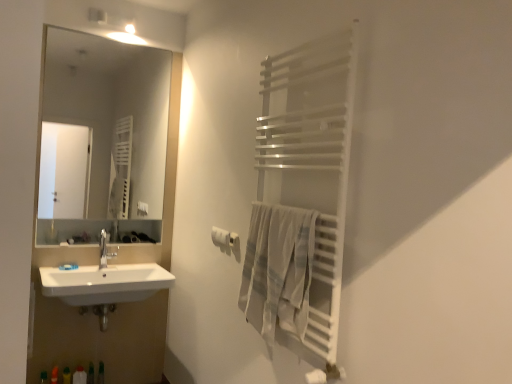
What are the coordinates of `white matte towel bar at upper right` in the screenshot? It's located at (233, 239).

Where is `white plastic bottle at lower left, which appears as the first toiletry when viewed from the left`? This screenshot has height=384, width=512. white plastic bottle at lower left, which appears as the first toiletry when viewed from the left is located at coordinates (79, 376).

How much space does white plastic bottle at lower left, which ranks as the second toiletry in right-to-left order, occupy horizontally?

white plastic bottle at lower left, which ranks as the second toiletry in right-to-left order, is 3.28 inches in width.

What are the coordinates of `white metallic towel rack at right` in the screenshot? It's located at (311, 161).

The width and height of the screenshot is (512, 384). What do you see at coordinates (311, 161) in the screenshot? I see `white metallic towel rack at right` at bounding box center [311, 161].

The image size is (512, 384). What do you see at coordinates (278, 269) in the screenshot? I see `light gray woven towel at right` at bounding box center [278, 269].

What do you see at coordinates (100, 373) in the screenshot? I see `translucent plastic bottle at lower left, which is the 1th toiletry in right-to-left order` at bounding box center [100, 373].

This screenshot has width=512, height=384. What do you see at coordinates (221, 236) in the screenshot?
I see `white matte toilet paper at center` at bounding box center [221, 236].

Where is `clear glass mirror at upper left`? This screenshot has width=512, height=384. clear glass mirror at upper left is located at coordinates tap(102, 140).

Is white matte toilet paper at center facing away from white plastic bottle at lower left, which appears as the first toiletry when viewed from the left?

That's not correct — white matte toilet paper at center is not looking away from white plastic bottle at lower left, which appears as the first toiletry when viewed from the left.

Which point is more forward, (213, 238) or (74, 376)?

The point (213, 238) is closer.

Which object is positioned more to the left, white matte toilet paper at center or white plastic bottle at lower left, which ranks as the second toiletry in right-to-left order?

From the viewer's perspective, white plastic bottle at lower left, which ranks as the second toiletry in right-to-left order, appears more on the left side.

Is light gray woven towel at right looking in the opposite direction of translucent plastic bottle at lower left, which is the 1th toiletry in right-to-left order?

No, translucent plastic bottle at lower left, which is the 1th toiletry in right-to-left order, is not at the back of light gray woven towel at right.

Which of these two, light gray woven towel at right or translucent plastic bottle at lower left, placed as the 2th toiletry when sorted from left to right, stands shorter?

translucent plastic bottle at lower left, placed as the 2th toiletry when sorted from left to right.

Does light gray woven towel at right have a smaller size compared to translucent plastic bottle at lower left, placed as the 2th toiletry when sorted from left to right?

No, light gray woven towel at right is not smaller than translucent plastic bottle at lower left, placed as the 2th toiletry when sorted from left to right.

Image resolution: width=512 pixels, height=384 pixels. What are the coordinates of `bath towel above the translucent plastic bottle at lower left, placed as the 2th toiletry when sorted from left to right (from the image's perspective)` in the screenshot? It's located at (278, 269).

From the picture: Between translucent plastic bottle at lower left, placed as the 2th toiletry when sorted from left to right, and white metallic towel rack at right, which one is positioned in front?

white metallic towel rack at right.

Looking at this image, is translucent plastic bottle at lower left, placed as the 2th toiletry when sorted from left to right, turned away from white metallic towel rack at right?

That's not correct — translucent plastic bottle at lower left, placed as the 2th toiletry when sorted from left to right, is not looking away from white metallic towel rack at right.

From the image's perspective, is translucent plastic bottle at lower left, placed as the 2th toiletry when sorted from left to right, positioned above or below white metallic towel rack at right?

From the image's perspective, translucent plastic bottle at lower left, placed as the 2th toiletry when sorted from left to right, appears below white metallic towel rack at right.

Is satin nickel faucet at sink left completely or partially outside of white matte towel bar at upper right?

That's correct, satin nickel faucet at sink left is outside of white matte towel bar at upper right.

Can you confirm if satin nickel faucet at sink left is wider than white matte towel bar at upper right?

Yes, satin nickel faucet at sink left is wider than white matte towel bar at upper right.

From a real-world perspective, is satin nickel faucet at sink left below white matte towel bar at upper right?

Yes, from a real-world perspective, satin nickel faucet at sink left is beneath white matte towel bar at upper right.

Locate an element on the screen. towel bar that is above the satin nickel faucet at sink left (from the image's perspective) is located at coordinates (233, 239).

Based on the photo, how many degrees apart are the facing directions of satin nickel faucet at sink left and white metallic towel rack at right?

The angular difference between satin nickel faucet at sink left and white metallic towel rack at right is 87.7 degrees.

Does satin nickel faucet at sink left have a greater height compared to white metallic towel rack at right?

Incorrect, the height of satin nickel faucet at sink left is not larger of that of white metallic towel rack at right.

Is satin nickel faucet at sink left positioned with its back to white metallic towel rack at right?

No, satin nickel faucet at sink left is not facing the opposite direction of white metallic towel rack at right.

Considering the relative sizes of satin nickel faucet at sink left and white metallic towel rack at right in the image provided, is satin nickel faucet at sink left smaller than white metallic towel rack at right?

Correct, satin nickel faucet at sink left occupies less space than white metallic towel rack at right.

Which object is positioned more to the left, white matte toilet paper at center or light gray woven towel at right?

white matte toilet paper at center is more to the left.

Is point (223, 235) positioned behind point (263, 301)?

Yes, point (223, 235) is behind point (263, 301).

Which of these two, white matte toilet paper at center or light gray woven towel at right, stands taller?

light gray woven towel at right is taller.

Is there a large distance between white metallic towel rack at right and light gray woven towel at right?

No, white metallic towel rack at right is not far away from light gray woven towel at right.

Identify the location of balustrade on the left of light gray woven towel at right. The width and height of the screenshot is (512, 384). (311, 161).

Considering the points (273, 163) and (256, 225), which point is behind, point (273, 163) or point (256, 225)?

The point (273, 163) is farther.

The width and height of the screenshot is (512, 384). In order to click on the 1st toiletry behind when counting from the white matte toilet paper at center in this screenshot , I will do (x=79, y=376).

This screenshot has width=512, height=384. There is a light gray woven towel at right. Identify the location of the 1st toiletry below it (from the image's perspective). (100, 373).

Based on their spatial positions, is white matte towel bar at upper right or light gray woven towel at right further from white plastic bottle at lower left, which appears as the first toiletry when viewed from the left?

Based on the image, light gray woven towel at right appears to be further to white plastic bottle at lower left, which appears as the first toiletry when viewed from the left.

Which object lies further to the anchor point clear glass mirror at upper left, white metallic towel rack at right or satin nickel faucet at sink left?

Based on the image, white metallic towel rack at right appears to be further to clear glass mirror at upper left.

Based on their spatial positions, is satin nickel faucet at sink left or white matte toilet paper at center closer to clear glass mirror at upper left?

satin nickel faucet at sink left is closer to clear glass mirror at upper left.

Based on their spatial positions, is satin nickel faucet at sink left or white plastic bottle at lower left, which ranks as the second toiletry in right-to-left order, further from clear glass mirror at upper left?

Based on the image, white plastic bottle at lower left, which ranks as the second toiletry in right-to-left order, appears to be further to clear glass mirror at upper left.

Which object lies nearer to the anchor point white matte toilet paper at center, satin nickel faucet at sink left or clear glass mirror at upper left?

Based on the image, satin nickel faucet at sink left appears to be nearer to white matte toilet paper at center.

Considering their positions, is white matte toilet paper at center positioned closer to translucent plastic bottle at lower left, which is the 1th toiletry in right-to-left order, than light gray woven towel at right?

The object closer to translucent plastic bottle at lower left, which is the 1th toiletry in right-to-left order, is white matte toilet paper at center.

Based on their spatial positions, is white plastic bottle at lower left, which appears as the first toiletry when viewed from the left, or satin nickel faucet at sink left further from white matte towel bar at upper right?

The object further to white matte towel bar at upper right is white plastic bottle at lower left, which appears as the first toiletry when viewed from the left.

Based on the photo, based on their spatial positions, is clear glass mirror at upper left or light gray woven towel at right closer to translucent plastic bottle at lower left, which is the 1th toiletry in right-to-left order?

light gray woven towel at right is positioned closer to the anchor translucent plastic bottle at lower left, which is the 1th toiletry in right-to-left order.

Identify the location of toiletry that lies between satin nickel faucet at sink left and white plastic bottle at lower left, which appears as the first toiletry when viewed from the left, from top to bottom. Image resolution: width=512 pixels, height=384 pixels. (100, 373).

This screenshot has width=512, height=384. What are the coordinates of `toilet paper positioned between white metallic towel rack at right and white plastic bottle at lower left, which appears as the first toiletry when viewed from the left, from near to far` in the screenshot? It's located at (221, 236).

Locate an element on the screen. This screenshot has width=512, height=384. tap between white matte toilet paper at center and white plastic bottle at lower left, which appears as the first toiletry when viewed from the left, in the vertical direction is located at coordinates (104, 249).

The height and width of the screenshot is (384, 512). Find the location of `toilet paper between light gray woven towel at right and clear glass mirror at upper left along the z-axis`. toilet paper between light gray woven towel at right and clear glass mirror at upper left along the z-axis is located at coordinates (221, 236).